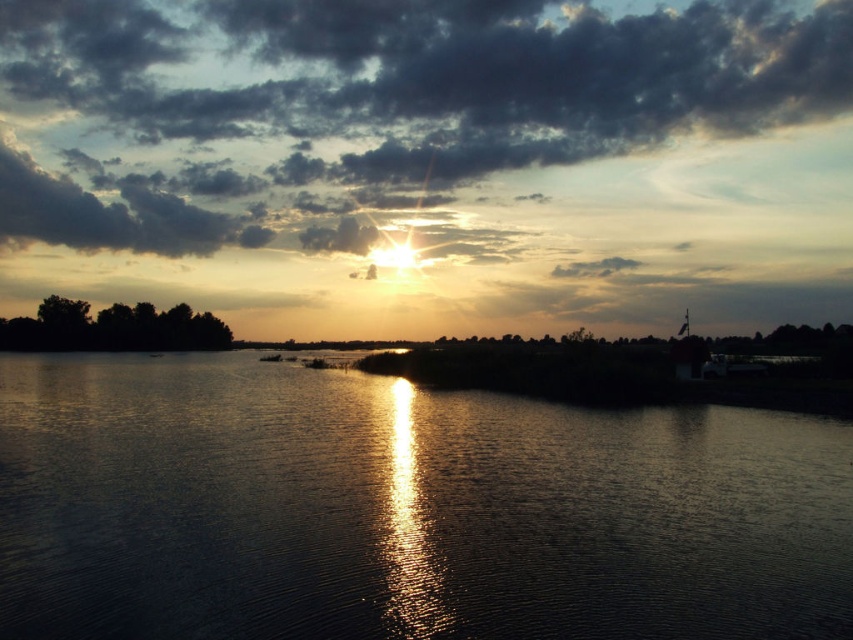
You are a photographer trying to capture the sunset. You have a camera with a 100mm lens that can focus on objects up to 200 meters away. Can you focus your camera on the silvery reflective water at center while keeping the smokey gray cloud at upper center in focus?

The silvery reflective water at center is 216.48 meters from the smokey gray cloud at upper center. Since the camera can focus up to 200 meters, the distance between them exceeds the lens capability, so both cannot be in focus simultaneously.

You are an artist trying to paint the sunset scene. You notice the silvery reflective water at center and the smokey gray cloud at upper center. Which object takes up more area in the painting?

The smokey gray cloud at upper center takes up more area in the painting because the silvery reflective water at center occupies less space than it.

You are standing at the edge of the lake and see two points in the water. The first point is at coordinates point (322, 502) and the second is at point (65, 132). Which point is closer to you?

Point (322, 502) is closer to the camera than point (65, 132), so the first point is closer to you.